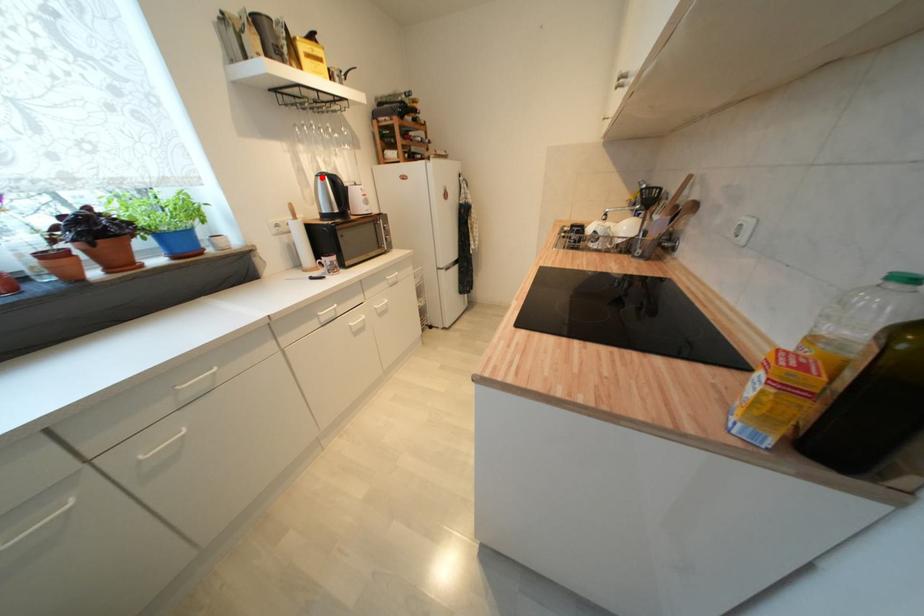
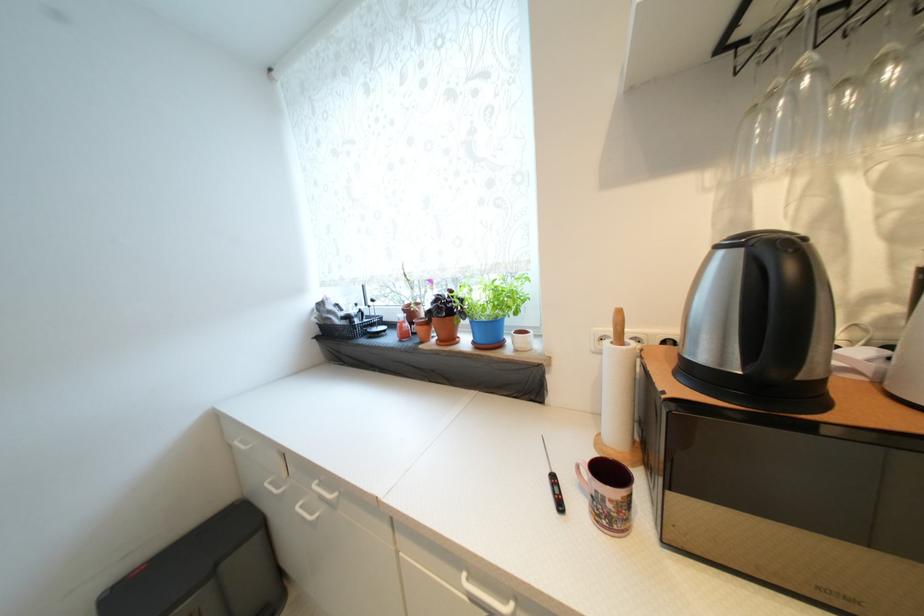
Where in the second image is the point corresponding to the highlighted location from the first image?

(723, 249)